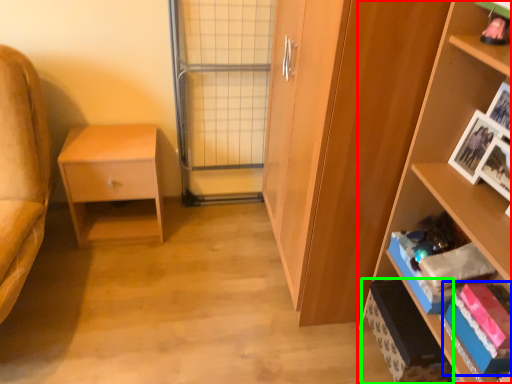
Question: Based on their relative distances, which object is farther from shelf (highlighted by a red box)? Choose from book (highlighted by a blue box) and cabinet (highlighted by a green box).

Choices:
 (A) book
 (B) cabinet

Answer: (B)